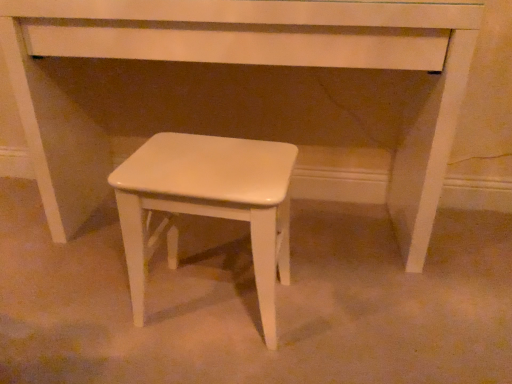
Question: Does white matte stool at center lie behind white matte stool at center?

Choices:
 (A) no
 (B) yes

Answer: (B)

Question: Does white matte stool at center have a greater height compared to white matte stool at center?

Choices:
 (A) no
 (B) yes

Answer: (B)

Question: Considering the relative sizes of white matte stool at center and white matte stool at center in the image provided, is white matte stool at center smaller than white matte stool at center?

Choices:
 (A) yes
 (B) no

Answer: (B)

Question: Is white matte stool at center facing towards white matte stool at center?

Choices:
 (A) no
 (B) yes

Answer: (B)

Question: From a real-world perspective, does white matte stool at center sit lower than white matte stool at center?

Choices:
 (A) no
 (B) yes

Answer: (A)

Question: Does white matte stool at center have a lesser height compared to white matte stool at center?

Choices:
 (A) no
 (B) yes

Answer: (A)

Question: Considering the relative sizes of white matte stool at center and white matte stool at center in the image provided, is white matte stool at center bigger than white matte stool at center?

Choices:
 (A) yes
 (B) no

Answer: (B)

Question: Is white matte stool at center oriented towards white matte stool at center?

Choices:
 (A) yes
 (B) no

Answer: (B)

Question: From a real-world perspective, does white matte stool at center sit lower than white matte stool at center?

Choices:
 (A) no
 (B) yes

Answer: (B)

Question: Is the depth of white matte stool at center less than that of white matte stool at center?

Choices:
 (A) yes
 (B) no

Answer: (A)

Question: Is white matte stool at center far away from white matte stool at center?

Choices:
 (A) yes
 (B) no

Answer: (B)

Question: Is white matte stool at center at the left side of white matte stool at center?

Choices:
 (A) no
 (B) yes

Answer: (B)

Question: Looking at the image, does white matte stool at center seem bigger or smaller compared to white matte stool at center?

Choices:
 (A) small
 (B) big

Answer: (A)